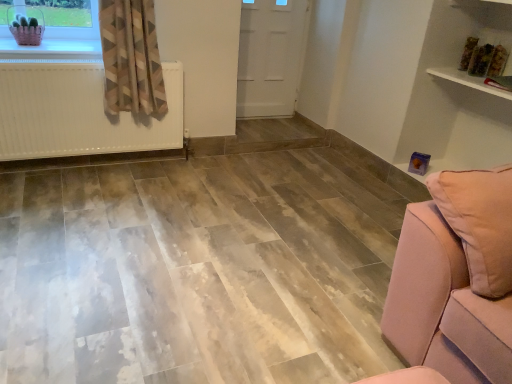
Question: Is matte plastic basket at upper left to the left of white glossy shelf at upper right from the viewer's perspective?

Choices:
 (A) no
 (B) yes

Answer: (B)

Question: From a real-world perspective, does matte plastic basket at upper left sit lower than white glossy shelf at upper right?

Choices:
 (A) no
 (B) yes

Answer: (B)

Question: Is matte plastic basket at upper left facing towards white glossy shelf at upper right?

Choices:
 (A) yes
 (B) no

Answer: (B)

Question: Is matte plastic basket at upper left smaller than white glossy shelf at upper right?

Choices:
 (A) no
 (B) yes

Answer: (B)

Question: Could white glossy shelf at upper right be considered to be inside matte plastic basket at upper left?

Choices:
 (A) no
 (B) yes

Answer: (A)

Question: From a real-world perspective, is white glossy shelf at upper right above or below geometric-patterned fabric curtain at left?

Choices:
 (A) above
 (B) below

Answer: (A)

Question: In the image, is white glossy shelf at upper right positioned in front of or behind geometric-patterned fabric curtain at left?

Choices:
 (A) front
 (B) behind

Answer: (A)

Question: Based on their positions, is white glossy shelf at upper right located to the left or right of geometric-patterned fabric curtain at left?

Choices:
 (A) left
 (B) right

Answer: (B)

Question: From their relative heights in the image, would you say white glossy shelf at upper right is taller or shorter than geometric-patterned fabric curtain at left?

Choices:
 (A) short
 (B) tall

Answer: (A)

Question: From the image's perspective, relative to matte plastic basket at upper left, is white matte door at center above or below?

Choices:
 (A) above
 (B) below

Answer: (A)

Question: Is white matte door at center wider or thinner than matte plastic basket at upper left?

Choices:
 (A) wide
 (B) thin

Answer: (B)

Question: In the image, is white matte door at center on the left side or the right side of matte plastic basket at upper left?

Choices:
 (A) left
 (B) right

Answer: (B)

Question: Looking at the image, does white matte door at center seem bigger or smaller compared to matte plastic basket at upper left?

Choices:
 (A) small
 (B) big

Answer: (B)

Question: Considering the positions of white matte radiator at left and matte plastic basket at upper left in the image, is white matte radiator at left taller or shorter than matte plastic basket at upper left?

Choices:
 (A) short
 (B) tall

Answer: (B)

Question: From the image's perspective, is white matte radiator at left above or below matte plastic basket at upper left?

Choices:
 (A) below
 (B) above

Answer: (A)